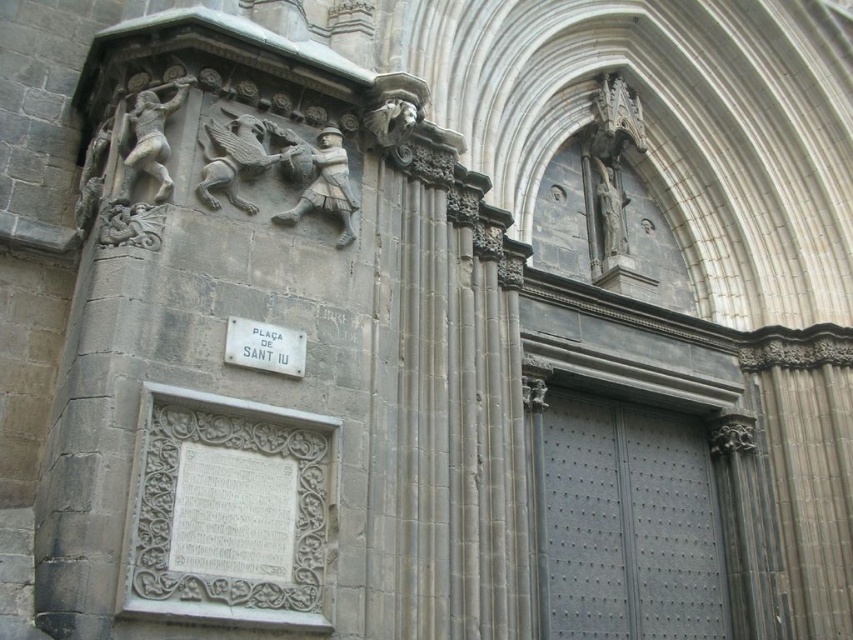
Between white metal plaque at lower left and white stone plaque at center, which one appears on the right side from the viewer's perspective?

white stone plaque at center

In the scene shown: Can you confirm if white metal plaque at lower left is positioned to the left of white stone plaque at center?

Correct, you'll find white metal plaque at lower left to the left of white stone plaque at center.

Locate an element on the screen. Image resolution: width=853 pixels, height=640 pixels. white metal plaque at lower left is located at coordinates (264, 346).

Which of these two, gray metallic door at center or white metal plaque at lower left, stands shorter?

white metal plaque at lower left is shorter.

Find the location of `gray metallic door at center`. gray metallic door at center is located at coordinates (625, 524).

What are the coordinates of `gray metallic door at center` in the screenshot? It's located at tap(625, 524).

Who is more forward, (549, 467) or (264, 364)?

Point (264, 364) is in front.

Can you confirm if gray metallic door at center is wider than white stone plaque at center?

Indeed, gray metallic door at center has a greater width compared to white stone plaque at center.

Between point (659, 474) and point (242, 330), which one is positioned behind?

Positioned behind is point (659, 474).

Locate an element on the screen. gray metallic door at center is located at coordinates (625, 524).